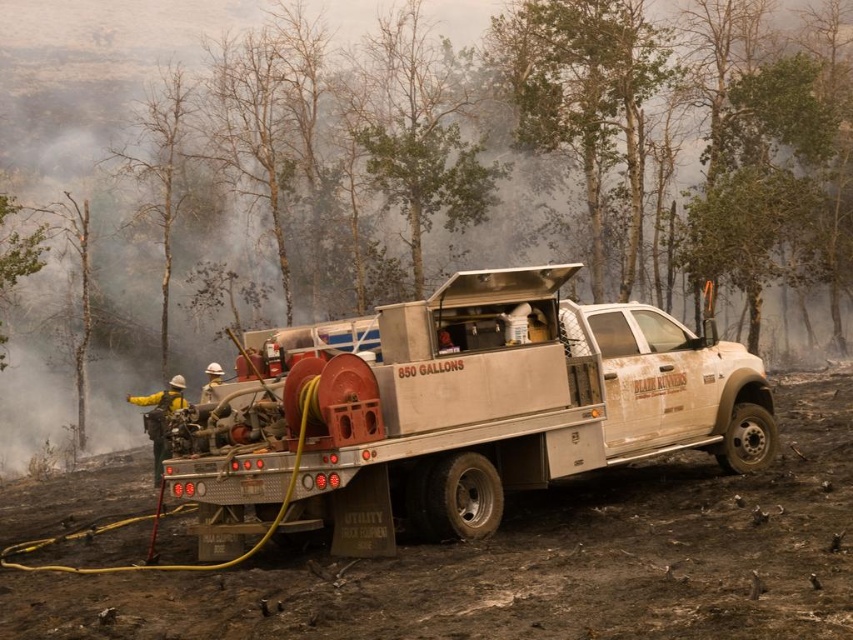
You are a firefighter assessing the wildfire scene. You notice the green leafy tree at center and the white matte utility truck at center. Which object has a greater width?

The green leafy tree at center has a greater width than the white matte utility truck at center.

In the scene shown: You are a firefighter standing in front of the white pickup truck. You need to reach both the green leafy tree at center and the yellow reflective jacket at center. Which object will you reach first as you move forward?

You will reach the green leafy tree at center first because it is closer to you than the yellow reflective jacket at center.

You are a firefighter assessing the scene. You see the white matte utility truck at center and the yellow reflective jacket at center. Which object is covering the other one?

The white matte utility truck at center is positioned over the yellow reflective jacket at center, so the truck is covering the jacket.